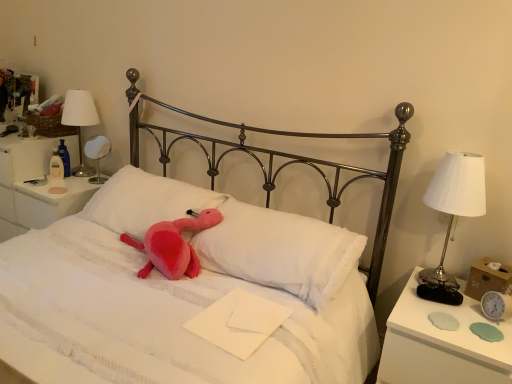
I want to click on free location in front of white fabric lampshade at right, which appears as the third bedside lamp when viewed from the left, so click(443, 316).